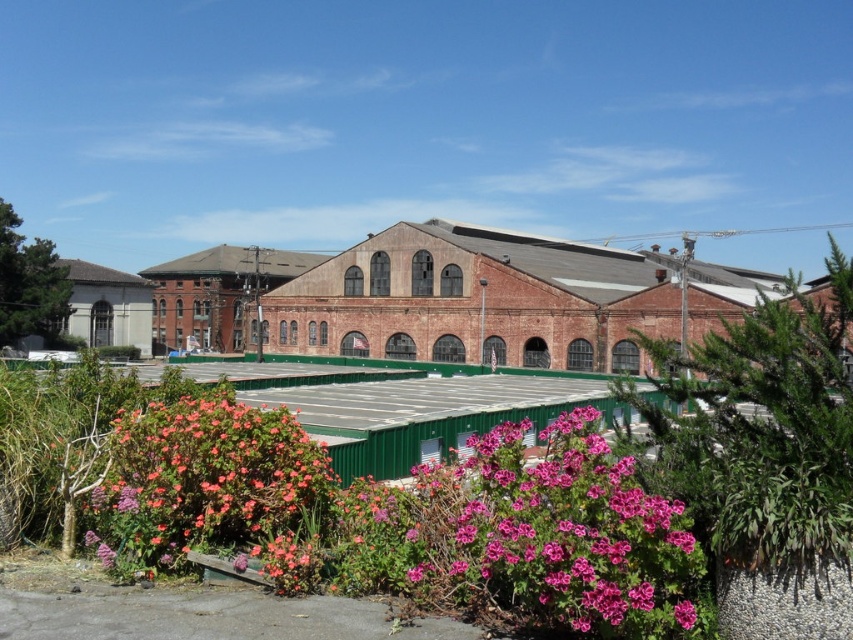
Who is taller, pink matte flower at lower center or pink matte flower at lower right?

pink matte flower at lower center

You are a GUI agent. You are given a task and a screenshot of the screen. Output one action in this format:
    pyautogui.click(x=<x>, y=<y>)
    Task: Click on the pink matte flower at lower center
    This screenshot has width=853, height=640.
    Given the screenshot: What is the action you would take?
    pyautogui.click(x=288, y=564)

Can you confirm if pink matte flower at lower left is positioned above pink matte flower at lower center?

Indeed, pink matte flower at lower left is positioned over pink matte flower at lower center.

Can you confirm if pink matte flower at lower left is wider than pink matte flower at lower center?

Indeed, pink matte flower at lower left has a greater width compared to pink matte flower at lower center.

Between point (200, 452) and point (312, 570), which one is positioned behind?

The point (200, 452) is behind.

The image size is (853, 640). I want to click on pink matte flower at lower left, so click(204, 481).

Is pink matte flower at lower left wider than pink matte flower at lower right?

Yes, pink matte flower at lower left is wider than pink matte flower at lower right.

Between point (210, 413) and point (686, 621), which one is positioned behind?

The point (210, 413) is behind.

Image resolution: width=853 pixels, height=640 pixels. I want to click on pink matte flower at lower left, so click(x=204, y=481).